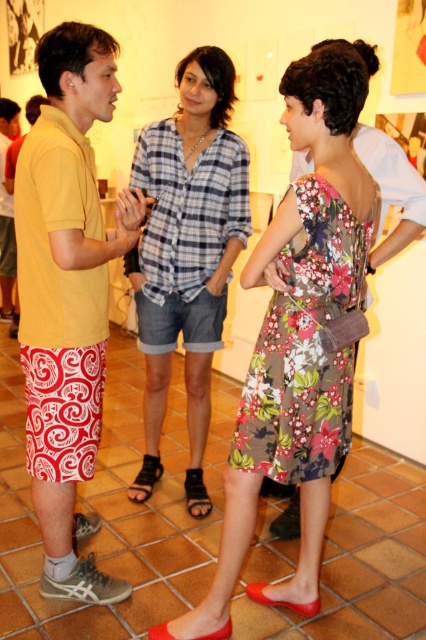
Question: Which object is closer to the camera taking this photo?

Choices:
 (A) yellow cotton shirt at left
 (B) floral-patterned fabric dress at center
 (C) floral fabric dress at center

Answer: (B)

Question: Among these objects, which one is nearest to the camera?

Choices:
 (A) floral-patterned fabric dress at center
 (B) yellow cotton shirt at left
 (C) floral fabric dress at center
 (D) plaid cotton shirt at center

Answer: (A)

Question: Which object is closer to the camera taking this photo?

Choices:
 (A) plaid cotton shirt at center
 (B) floral-patterned fabric dress at center

Answer: (B)

Question: Considering the relative positions of plaid cotton shirt at center and floral-patterned fabric dress at center in the image provided, where is plaid cotton shirt at center located with respect to floral-patterned fabric dress at center?

Choices:
 (A) right
 (B) left

Answer: (B)

Question: Is the position of floral fabric dress at center less distant than that of floral-patterned fabric dress at center?

Choices:
 (A) yes
 (B) no

Answer: (B)

Question: Does floral fabric dress at center have a greater width compared to yellow cotton shirt at left?

Choices:
 (A) yes
 (B) no

Answer: (A)